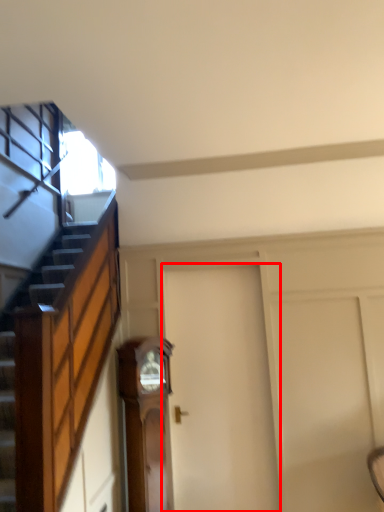
Question: From the image's perspective, where is door (annotated by the red box) located relative to furniture?

Choices:
 (A) above
 (B) below

Answer: (A)